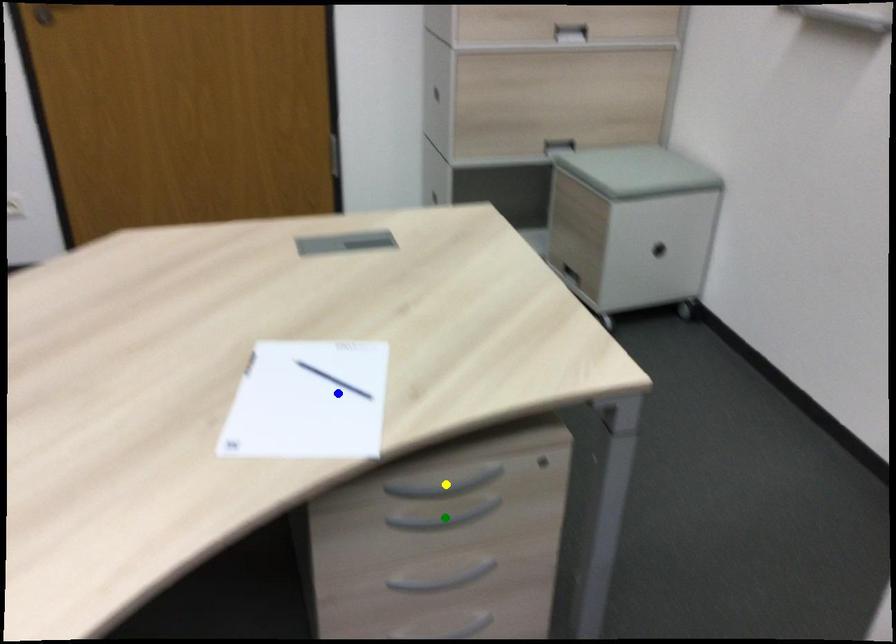
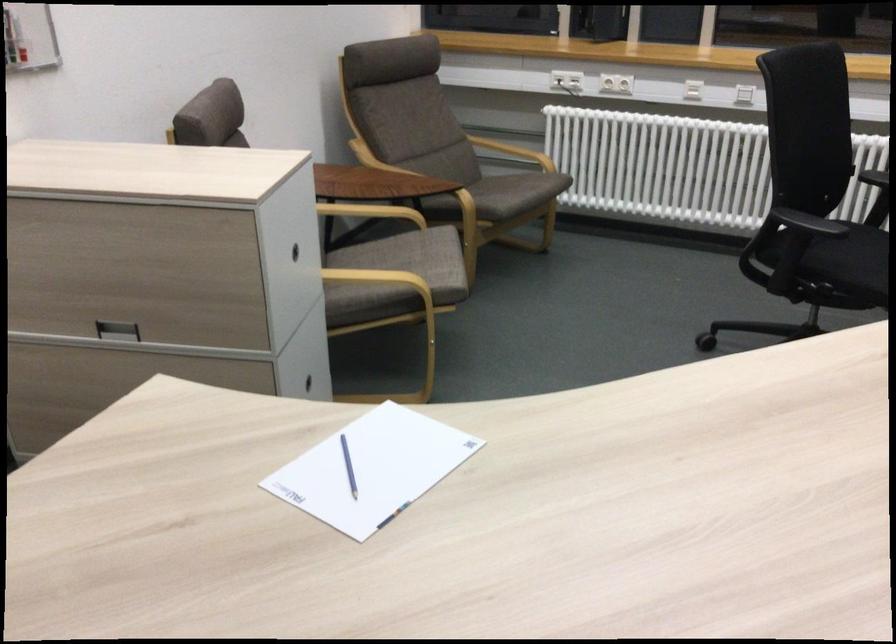
I am providing you with two images of the same scene from different viewpoints. Three points are marked in image1. Which point corresponds to a part or object that is occluded in image2?In image1, three points are marked. Which of them correspond to a part or object that is occluded in image2?Among the three points shown in image1, which one corresponds to a part or object that is no longer visible due to occlusion in image2?

Invisible in image2: yellow point, green point.